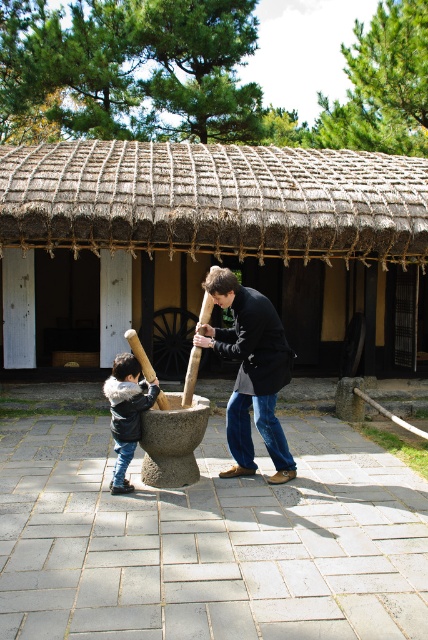
Question: Among these points, which one is nearest to the camera?

Choices:
 (A) (163, 403)
 (B) (297, 324)
 (C) (125, 417)

Answer: (C)

Question: Is thatched straw hut at center closer to the viewer compared to black fuzzy jacket at left?

Choices:
 (A) no
 (B) yes

Answer: (A)

Question: Among these points, which one is nearest to the camera?

Choices:
 (A) (211, 266)
 (B) (151, 365)
 (C) (246, 387)
 (D) (403, 211)

Answer: (C)

Question: Can you confirm if dark brown leather jacket at center is bigger than wooden baseball bat at center?

Choices:
 (A) no
 (B) yes

Answer: (B)

Question: In this image, where is thatched straw hut at center located relative to dark brown leather jacket at center?

Choices:
 (A) below
 (B) above

Answer: (B)

Question: Which of the following is the closest to the observer?

Choices:
 (A) dark brown leather jacket at center
 (B) black fuzzy jacket at left

Answer: (A)